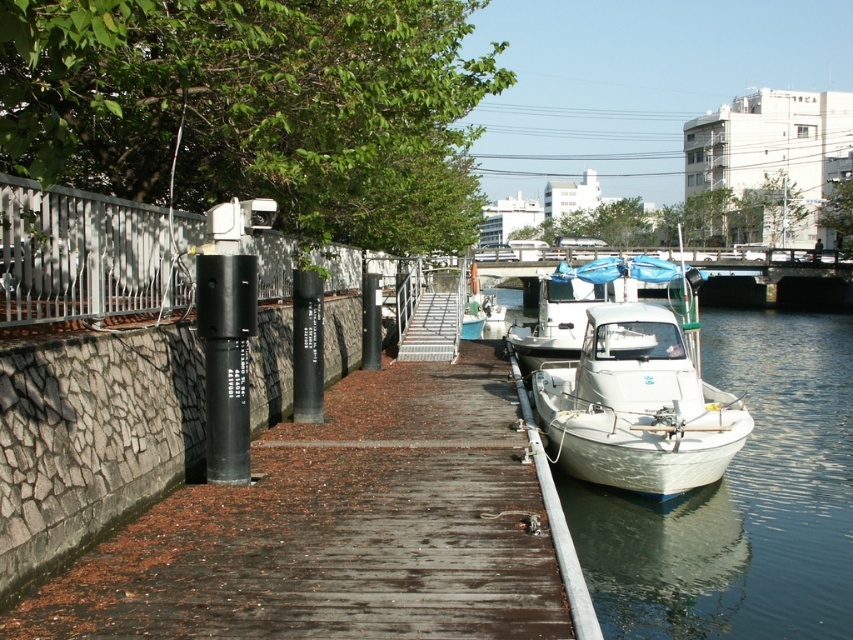
Question: Is white glossy boat at lower right behind white matte boat at lower right?

Choices:
 (A) yes
 (B) no

Answer: (B)

Question: Which point is farther to the camera?

Choices:
 (A) (476, 540)
 (B) (656, 465)

Answer: (B)

Question: Where is white matte boat at lower right located in relation to white matte boat at center in the image?

Choices:
 (A) left
 (B) right

Answer: (A)

Question: Is white glossy boat at lower right wider than white matte boat at center?

Choices:
 (A) no
 (B) yes

Answer: (B)

Question: Which of the following is the farthest from the observer?

Choices:
 (A) (664, 476)
 (B) (567, 288)

Answer: (B)

Question: Which point is farther to the camera?

Choices:
 (A) (601, 372)
 (B) (732, 620)
 (C) (451, 440)
 (D) (650, 262)

Answer: (D)